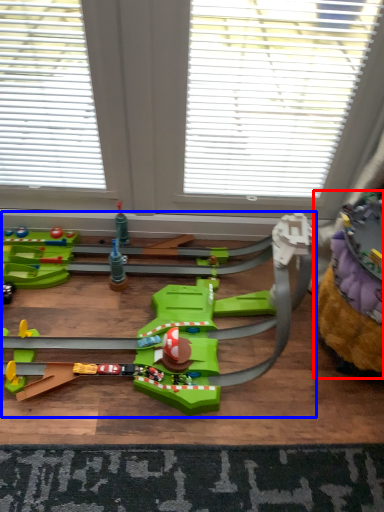
Question: Which of the following is the farthest to the observer, toy (highlighted by a red box) or toy (highlighted by a blue box)?

Choices:
 (A) toy
 (B) toy

Answer: (A)